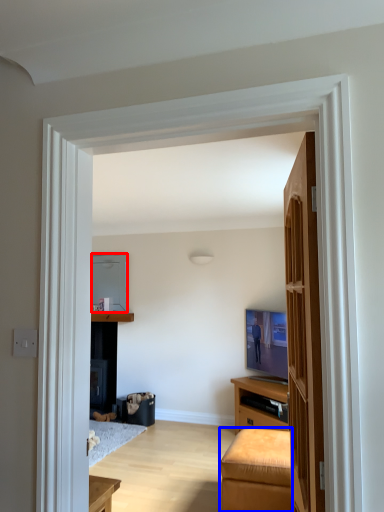
Question: Among these objects, which one is farthest to the camera, appliance (highlighted by a red box) or furniture (highlighted by a blue box)?

Choices:
 (A) appliance
 (B) furniture

Answer: (A)